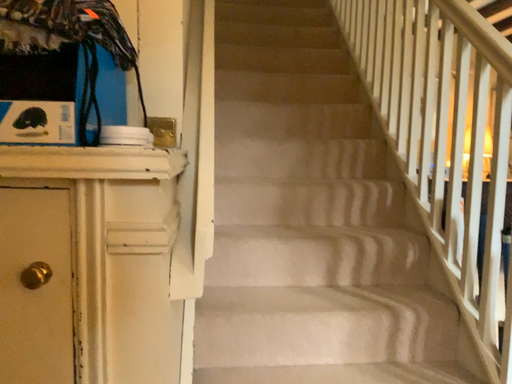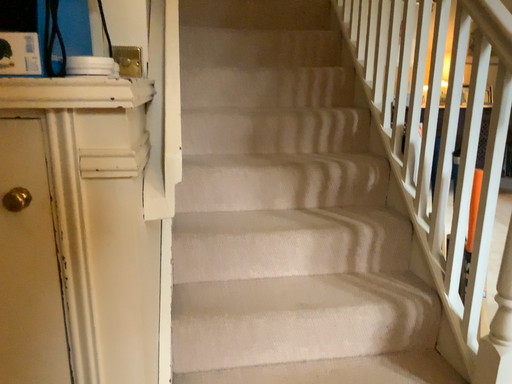
Question: Which way did the camera rotate in the video?

Choices:
 (A) rotated upward
 (B) rotated downward

Answer: (B)